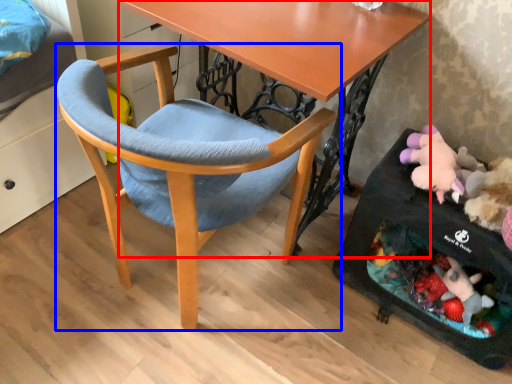
Question: Which object is further to the camera taking this photo, desk (highlighted by a red box) or chair (highlighted by a blue box)?

Choices:
 (A) desk
 (B) chair

Answer: (A)